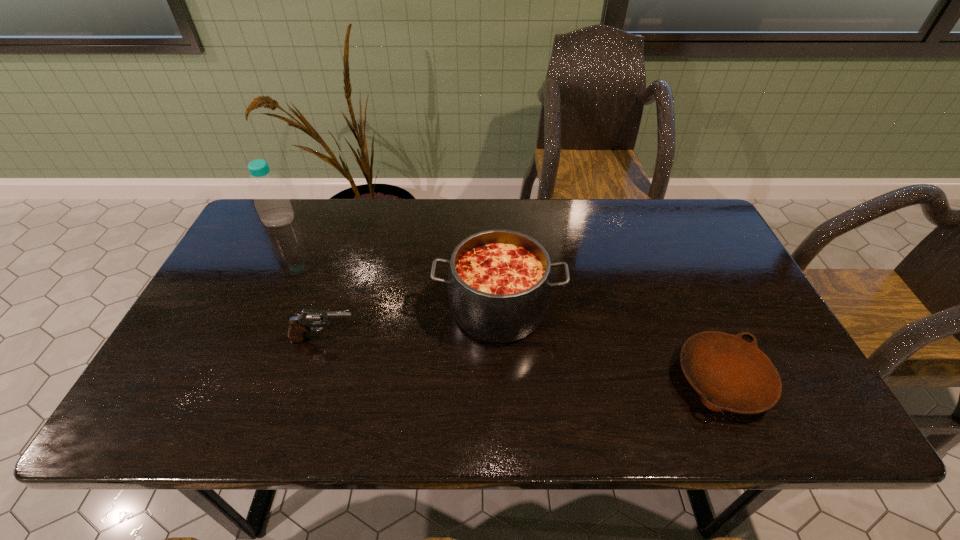
Locate an element on the screen. empty space between the second shortest object and the tallest object is located at coordinates (302, 280).

Locate an element on the screen. This screenshot has width=960, height=540. the second closest object to the pistol is located at coordinates (272, 203).

At what (x,y) coordinates should I click in order to perform the action: click on the closest object to the tallest object. Please return your answer as a coordinate pair (x, y). The width and height of the screenshot is (960, 540). Looking at the image, I should click on (299, 325).

Image resolution: width=960 pixels, height=540 pixels. What are the coordinates of `vacant space that satisfies the following two spatial constraints: 1. on the front side of the bottle; 2. on the right side of the casserole` in the screenshot? It's located at (233, 309).

This screenshot has height=540, width=960. What are the coordinates of `vacant space that satisfies the following two spatial constraints: 1. on the front side of the second object from right to left; 2. at the barrel of the second object from left to right` in the screenshot? It's located at (499, 339).

The width and height of the screenshot is (960, 540). Find the location of `blank space that satisfies the following two spatial constraints: 1. on the front side of the second object from right to left; 2. on the left side of the leftmost object`. blank space that satisfies the following two spatial constraints: 1. on the front side of the second object from right to left; 2. on the left side of the leftmost object is located at coordinates (233, 309).